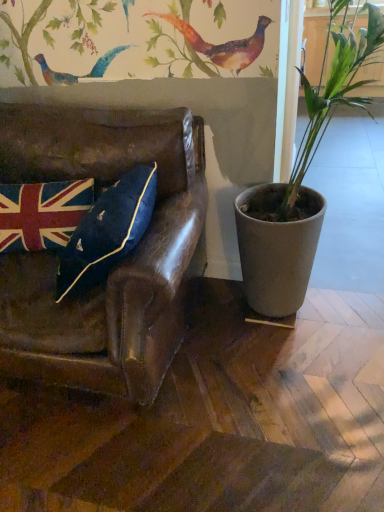
Question: Visually, is matte gray pot at right positioned to the left or to the right of leather couch at left?

Choices:
 (A) right
 (B) left

Answer: (A)

Question: From a real-world perspective, is matte gray pot at right above or below leather couch at left?

Choices:
 (A) above
 (B) below

Answer: (A)

Question: Which object is positioned farthest from the velvet union jack pillow at left?

Choices:
 (A) leather couch at left
 (B) matte gray pot at right

Answer: (B)

Question: Estimate the real-world distances between objects in this image. Which object is farther from the leather couch at left?

Choices:
 (A) matte gray pot at right
 (B) velvet union jack pillow at left

Answer: (A)